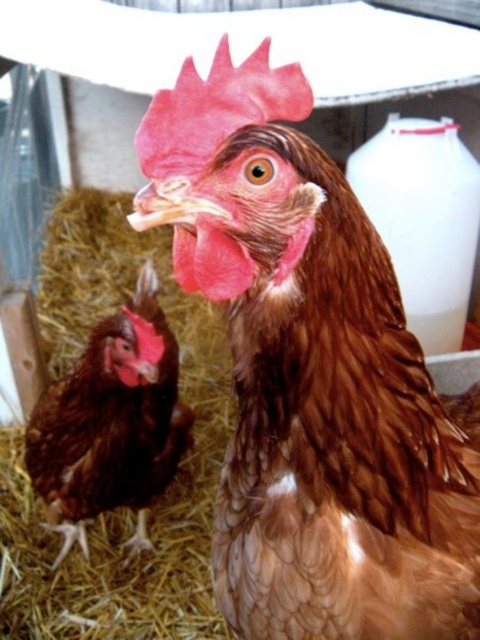
Question: Can you confirm if brown feathered chicken at center is positioned above brown feathered chicken at lower left?

Choices:
 (A) no
 (B) yes

Answer: (B)

Question: Which of the following is the closest to the observer?

Choices:
 (A) (286, 600)
 (B) (105, 464)

Answer: (A)

Question: Does brown feathered chicken at center have a smaller size compared to brown feathered chicken at lower left?

Choices:
 (A) yes
 (B) no

Answer: (A)

Question: Which point appears farthest from the camera in this image?

Choices:
 (A) (478, 488)
 (B) (73, 408)

Answer: (B)

Question: Which point is closer to the camera?

Choices:
 (A) brown feathered chicken at lower left
 (B) brown feathered chicken at center

Answer: (B)

Question: Where is brown feathered chicken at center located in relation to brown feathered chicken at lower left in the image?

Choices:
 (A) above
 (B) below

Answer: (A)